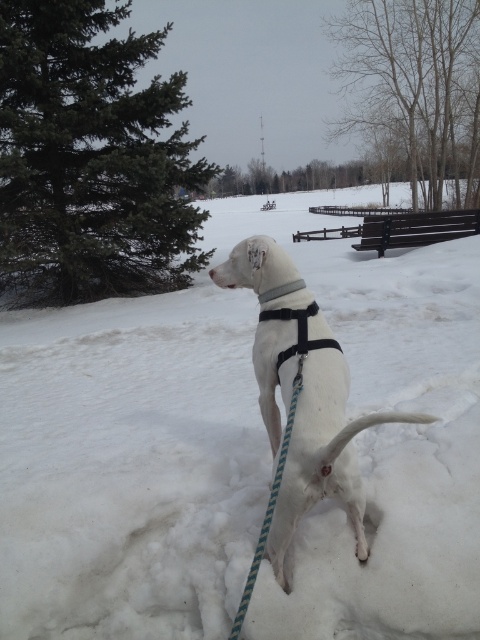
Does green textured pine tree at upper left have a smaller size compared to black nylon neckband at center?

No, green textured pine tree at upper left is not smaller than black nylon neckband at center.

Who is positioned more to the right, green textured pine tree at upper left or black nylon neckband at center?

black nylon neckband at center

This screenshot has height=640, width=480. Describe the element at coordinates (91, 160) in the screenshot. I see `green textured pine tree at upper left` at that location.

Identify the location of green textured pine tree at upper left. The height and width of the screenshot is (640, 480). (91, 160).

Who is lower down, green textured pine tree at upper left or white matte harness at center?

white matte harness at center is below.

Is point (107, 177) closer to camera compared to point (277, 317)?

No, it is not.

Which is behind, point (83, 68) or point (357, 540)?

The point (83, 68) is behind.

This screenshot has height=640, width=480. I want to click on green textured pine tree at upper left, so click(x=91, y=160).

Which is behind, point (391, 595) or point (294, 288)?

Point (294, 288)

Does white fluffy snow at center appear on the right side of black nylon neckband at center?

Incorrect, white fluffy snow at center is not on the right side of black nylon neckband at center.

The height and width of the screenshot is (640, 480). What are the coordinates of `white fluffy snow at center` in the screenshot? It's located at (130, 465).

The width and height of the screenshot is (480, 640). I want to click on white fluffy snow at center, so click(130, 465).